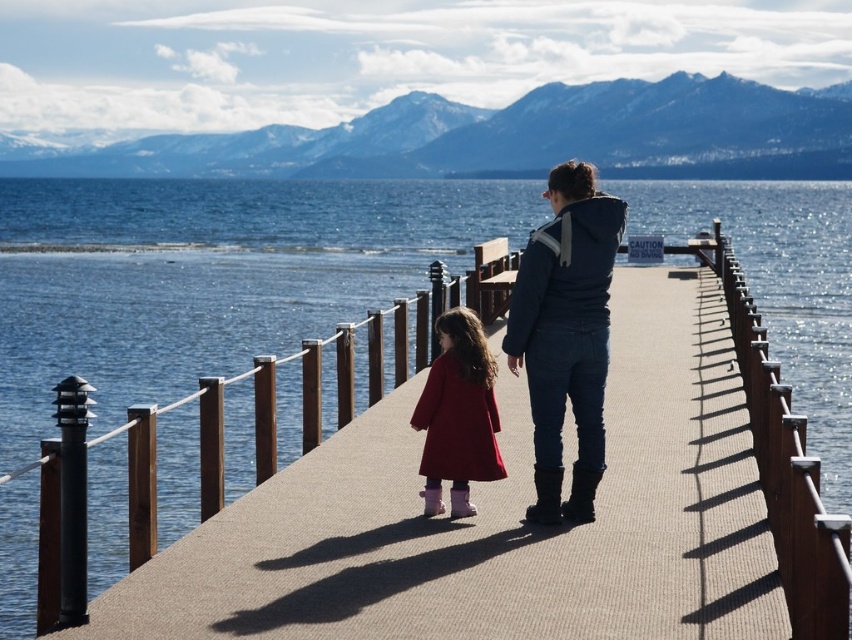
Question: Which point is closer to the camera?

Choices:
 (A) denim jacket at center
 (B) matte red coat at center
 (C) blue water at center

Answer: (A)

Question: Which point is closer to the camera taking this photo?

Choices:
 (A) (514, 330)
 (B) (459, 432)

Answer: (B)

Question: Is denim jacket at center above matte red coat at center?

Choices:
 (A) no
 (B) yes

Answer: (B)

Question: Is blue water at center positioned at the back of denim jacket at center?

Choices:
 (A) no
 (B) yes

Answer: (B)

Question: Which object appears closest to the camera in this image?

Choices:
 (A) matte red coat at center
 (B) denim jacket at center

Answer: (B)

Question: Can you confirm if blue water at center is bigger than matte red coat at center?

Choices:
 (A) no
 (B) yes

Answer: (B)